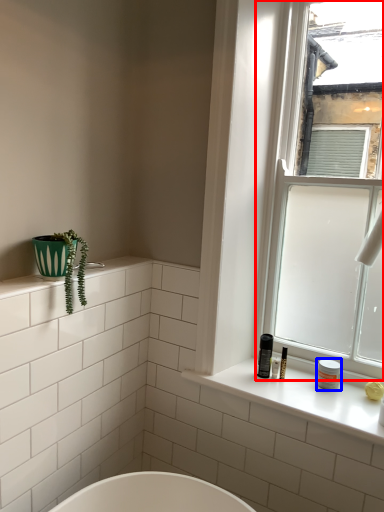
Question: Which object is further to the camera taking this photo, window (highlighted by a red box) or toiletry (highlighted by a blue box)?

Choices:
 (A) window
 (B) toiletry

Answer: (B)